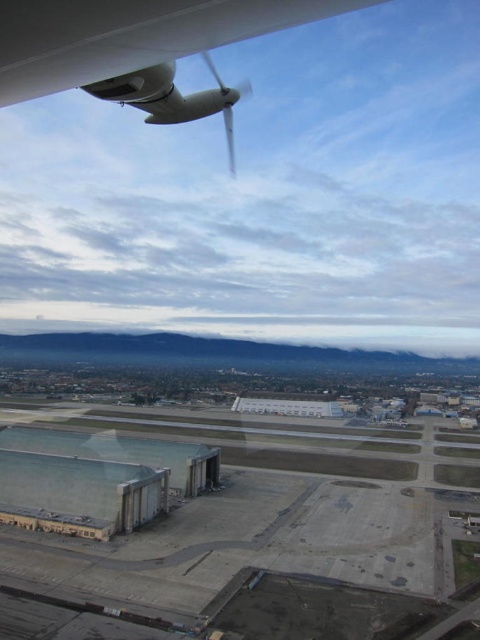
Question: Among these points, which one is nearest to the camera?

Choices:
 (A) (195, 3)
 (B) (84, 493)

Answer: (A)

Question: Estimate the real-world distances between objects in this image. Which object is farther from the gray concrete tarmac at lower center?

Choices:
 (A) white plastic propeller at upper center
 (B) white matte propeller at upper left

Answer: (B)

Question: Which point is farther to the camera?

Choices:
 (A) gray concrete tarmac at lower center
 (B) white plastic propeller at upper center
 (C) white matte propeller at upper left

Answer: (A)

Question: Is gray concrete tarmac at lower center to the left of white plastic propeller at upper center from the viewer's perspective?

Choices:
 (A) yes
 (B) no

Answer: (A)

Question: Is white matte propeller at upper left positioned in front of white plastic propeller at upper center?

Choices:
 (A) no
 (B) yes

Answer: (B)

Question: Is white matte propeller at upper left to the left of white plastic propeller at upper center from the viewer's perspective?

Choices:
 (A) yes
 (B) no

Answer: (A)